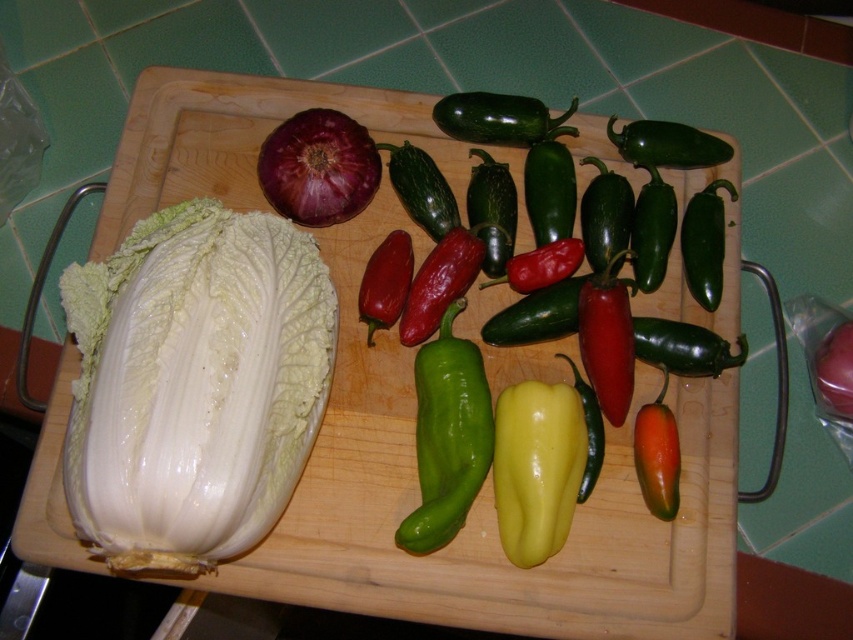
Question: Which object is positioned farthest from the matte purple onion at center?

Choices:
 (A) green matte cucumber at center
 (B) green glossy bell pepper at center
 (C) green glossy pepper at center

Answer: (C)

Question: Which is nearer to the matte purple onion at center?

Choices:
 (A) matte purple onion at upper left
 (B) green glossy pepper at center

Answer: (B)

Question: Where is green glossy jalapeño at upper center located in relation to green glossy pepper at center in the image?

Choices:
 (A) right
 (B) left

Answer: (B)

Question: From the image, what is the correct spatial relationship of green glossy bell pepper at center in relation to green matte bell pepper at center?

Choices:
 (A) left
 (B) right

Answer: (A)

Question: In this image, where is green matte bell pepper at center located relative to green matte cucumber at center?

Choices:
 (A) below
 (B) above

Answer: (A)

Question: Which is nearer to the green glossy bell pepper at center?

Choices:
 (A) matte purple onion at center
 (B) matte purple onion at upper left
 (C) green matte bell pepper at center
 (D) green glossy pepper at center

Answer: (C)